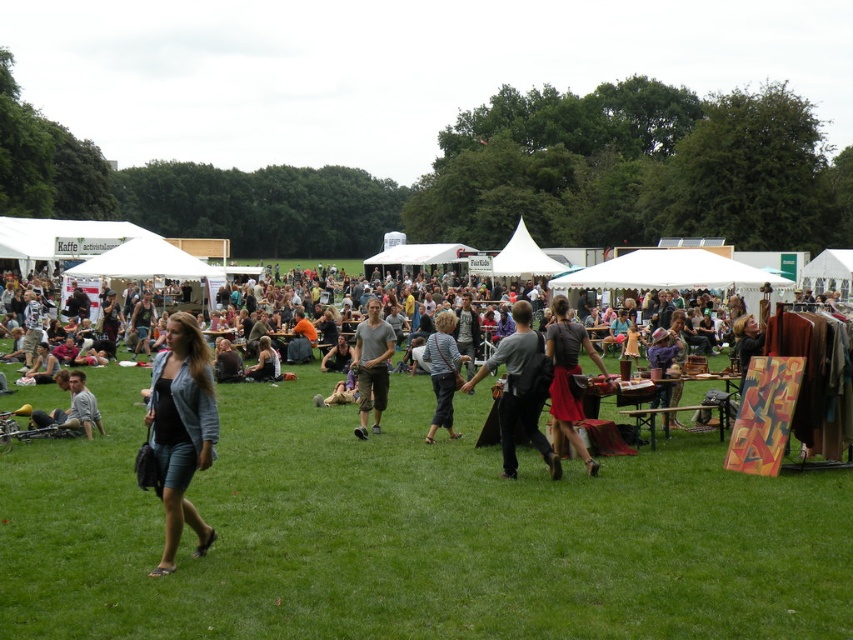
You are organizing a backpack and dress display at the event. Given the dark gray backpack at center and the matte black dress at center, which item requires more horizontal space for proper display?

The dark gray backpack at center requires more horizontal space because its width surpasses that of the matte black dress at center.